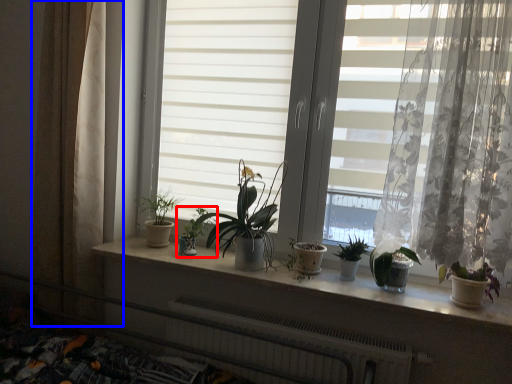
Question: Which object is closer to the camera taking this photo, houseplant (highlighted by a red box) or curtain (highlighted by a blue box)?

Choices:
 (A) houseplant
 (B) curtain

Answer: (B)